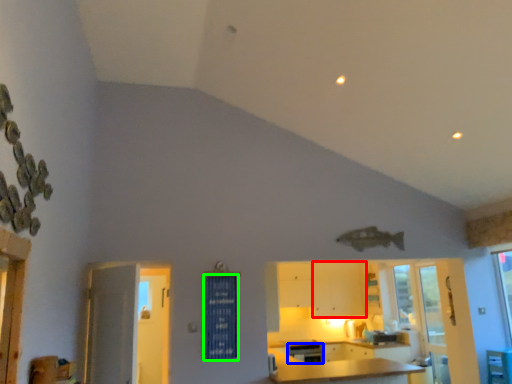
Question: Considering the real-world distances, which object is farthest from cabinetry (highlighted by a red box)? dish washer (highlighted by a blue box) or curtain (highlighted by a green box)?

Choices:
 (A) dish washer
 (B) curtain

Answer: (B)